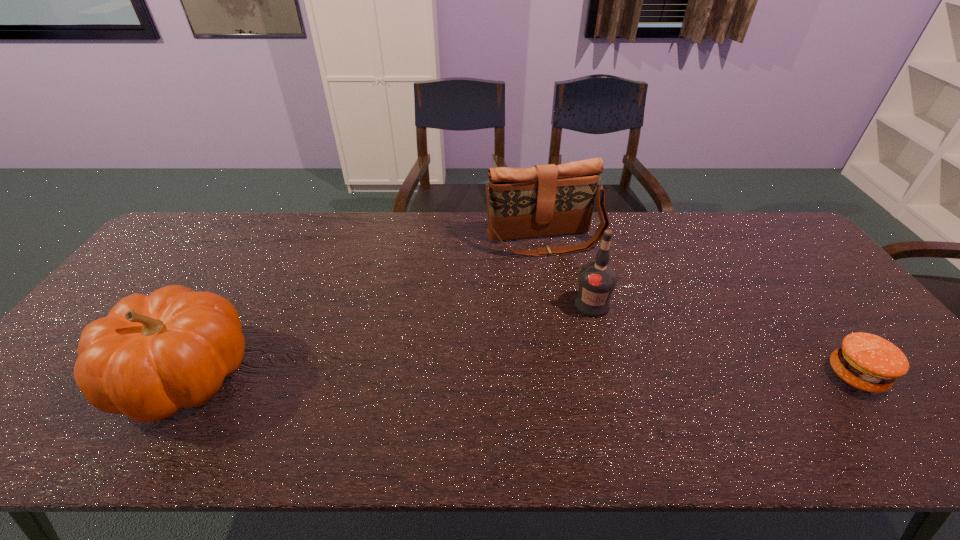
Find the location of `vacant area at the left edge of the desktop`. vacant area at the left edge of the desktop is located at coordinates (141, 291).

You are a GUI agent. You are given a task and a screenshot of the screen. Output one action in this format:
    pyautogui.click(x=<x>, y=<y>)
    Task: Click on the vacant region at the right edge of the desktop
    The image size is (960, 540).
    Given the screenshot: What is the action you would take?
    pyautogui.click(x=850, y=327)

Locate an element on the screen. This screenshot has width=960, height=540. unoccupied position between the third nearest object and the shoulder bag is located at coordinates (568, 272).

You are a GUI agent. You are given a task and a screenshot of the screen. Output one action in this format:
    pyautogui.click(x=<x>, y=<y>)
    Task: Click on the empty space that is in between the patty and the pumpkin
    
    Given the screenshot: What is the action you would take?
    pyautogui.click(x=520, y=375)

Locate an element on the screen. unoccupied position between the shoulder bag and the shortest object is located at coordinates (700, 307).

The image size is (960, 540). Find the location of `free space between the leftmost object and the vodka`. free space between the leftmost object and the vodka is located at coordinates (388, 340).

Find the location of `vacant space that is in between the farthest object and the vodka`. vacant space that is in between the farthest object and the vodka is located at coordinates (568, 272).

Image resolution: width=960 pixels, height=540 pixels. In order to click on free space between the pumpkin and the shoulder bag in this screenshot , I will do `click(365, 307)`.

In order to click on free space between the patty and the leftmost object in this screenshot , I will do `click(520, 375)`.

At what (x,y) coordinates should I click in order to perform the action: click on empty location between the third nearest object and the pumpkin. Please return your answer as a coordinate pair (x, y). Looking at the image, I should click on (388, 340).